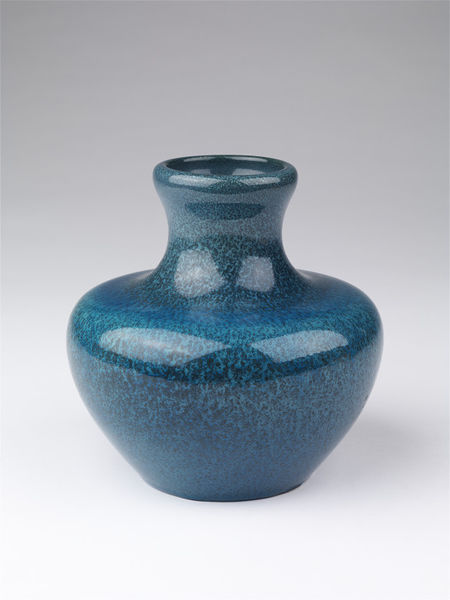
At what (x,y) coordinates should I click in order to perform the action: click on empty space below pot. Please return your answer as a coordinate pair (x, y). This screenshot has height=600, width=450. Looking at the image, I should click on (195, 557).